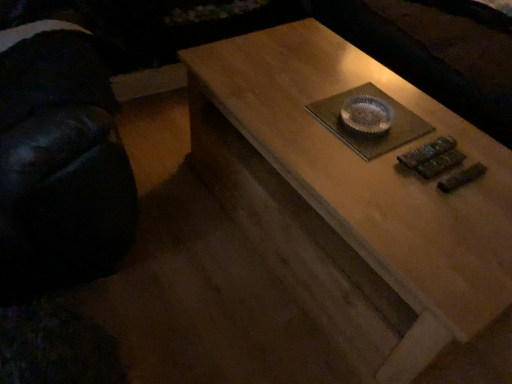
Where is `blank space situated above wooden coffee table at center (from a real-world perspective)`? blank space situated above wooden coffee table at center (from a real-world perspective) is located at coordinates (368, 142).